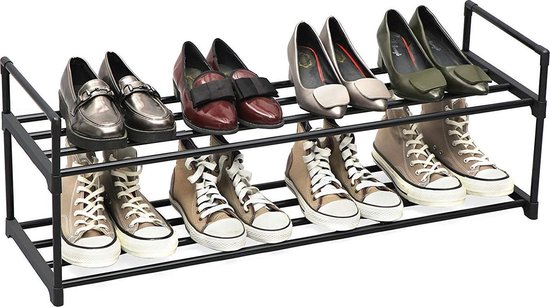
Where is `pairs of shoes`? This screenshot has width=550, height=307. pairs of shoes is located at coordinates (118, 103), (229, 86), (339, 70), (424, 43), (434, 152), (339, 172), (217, 180), (99, 188).